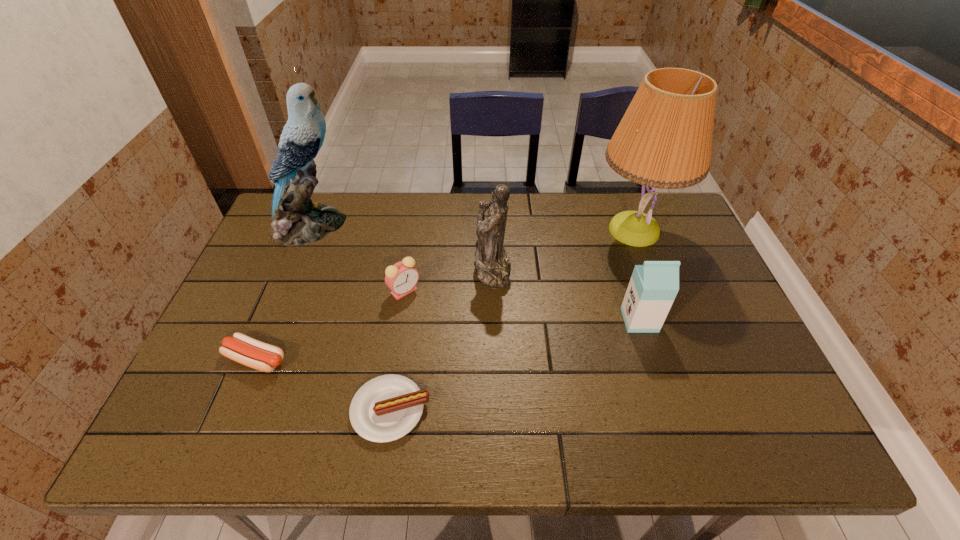
Find the location of a particular element. The height and width of the screenshot is (540, 960). free point that satisfies the following two spatial constraints: 1. on the face of the parakeet; 2. on the right side of the sixth tallest object is located at coordinates (255, 360).

I want to click on vacant area in the image that satisfies the following two spatial constraints: 1. on the face of the parakeet; 2. on the back side of the left sausage, so click(255, 360).